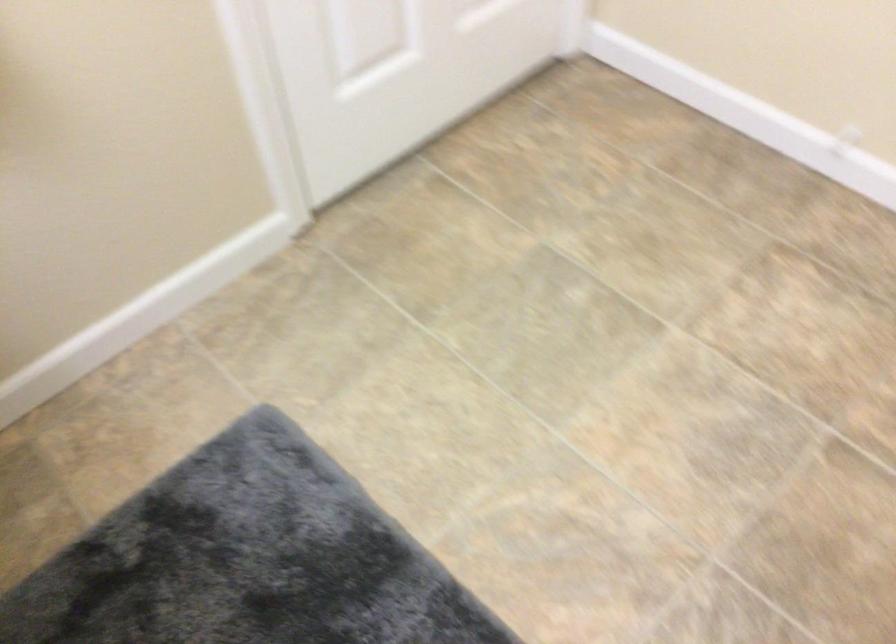
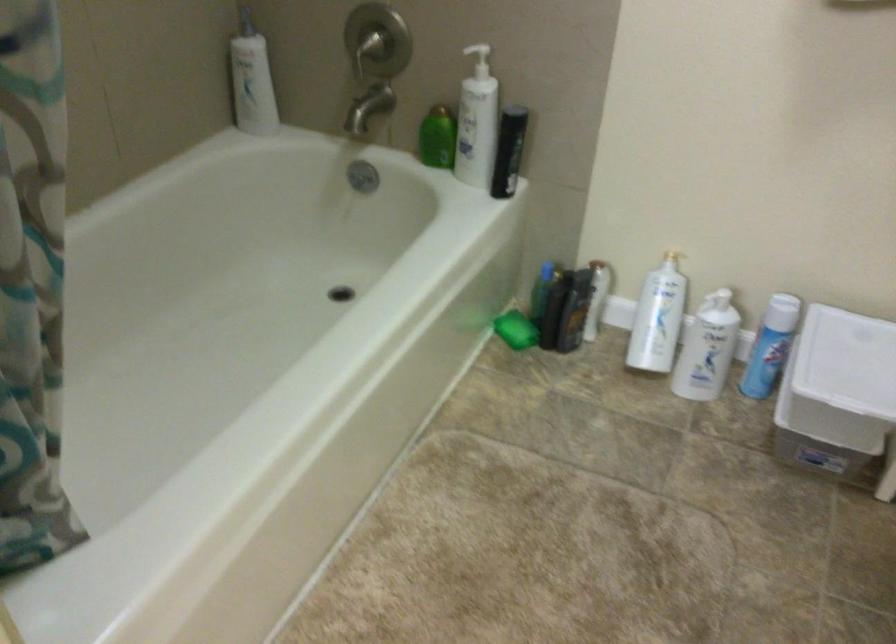
Question: The images are taken continuously from a first-person perspective. In which direction are you moving?

Choices:
 (A) Left
 (B) Right
 (C) Forward
 (D) Backward

Answer: (B)